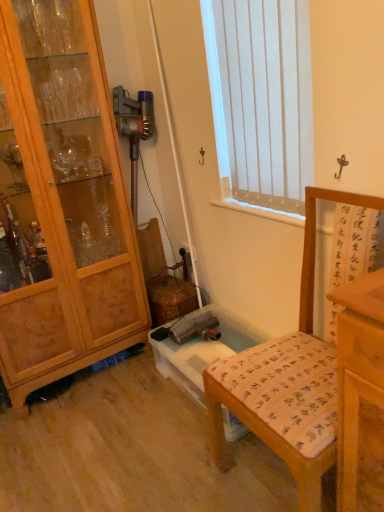
Question: Should I look upward or downward to see wooden cabinet at left?

Choices:
 (A) down
 (B) up

Answer: (B)

Question: Considering the relative sizes of white vertical blinds at upper center and wooden chair with printed cushion at lower right in the image provided, is white vertical blinds at upper center wider than wooden chair with printed cushion at lower right?

Choices:
 (A) yes
 (B) no

Answer: (B)

Question: From the image's perspective, is white vertical blinds at upper center beneath wooden chair with printed cushion at lower right?

Choices:
 (A) no
 (B) yes

Answer: (A)

Question: Does white vertical blinds at upper center have a smaller size compared to wooden chair with printed cushion at lower right?

Choices:
 (A) yes
 (B) no

Answer: (A)

Question: Could you tell me if white vertical blinds at upper center is turned towards wooden chair with printed cushion at lower right?

Choices:
 (A) yes
 (B) no

Answer: (B)

Question: Is white vertical blinds at upper center outside of wooden chair with printed cushion at lower right?

Choices:
 (A) yes
 (B) no

Answer: (A)

Question: Is white vertical blinds at upper center thinner than wooden chair with printed cushion at lower right?

Choices:
 (A) no
 (B) yes

Answer: (B)

Question: Is wooden cabinet at left in front of wooden chair with printed cushion at lower right?

Choices:
 (A) yes
 (B) no

Answer: (B)

Question: Considering the relative sizes of wooden cabinet at left and wooden chair with printed cushion at lower right in the image provided, is wooden cabinet at left shorter than wooden chair with printed cushion at lower right?

Choices:
 (A) yes
 (B) no

Answer: (B)

Question: Is wooden cabinet at left far from wooden chair with printed cushion at lower right?

Choices:
 (A) no
 (B) yes

Answer: (B)

Question: Is wooden cabinet at left turned away from wooden chair with printed cushion at lower right?

Choices:
 (A) yes
 (B) no

Answer: (B)

Question: From a real-world perspective, does wooden cabinet at left sit lower than wooden chair with printed cushion at lower right?

Choices:
 (A) yes
 (B) no

Answer: (B)

Question: Considering the relative sizes of wooden cabinet at left and wooden chair with printed cushion at lower right in the image provided, is wooden cabinet at left thinner than wooden chair with printed cushion at lower right?

Choices:
 (A) yes
 (B) no

Answer: (A)

Question: From a real-world perspective, is wooden chair with printed cushion at lower right positioned over wooden cabinet at left based on gravity?

Choices:
 (A) yes
 (B) no

Answer: (B)